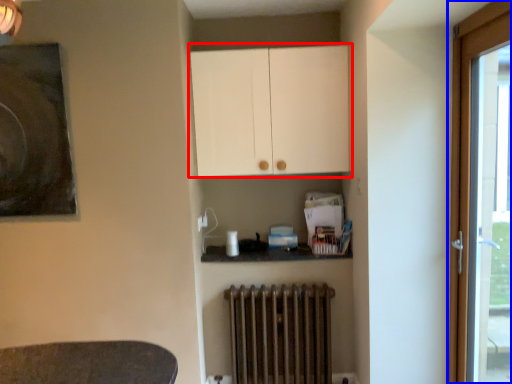
Question: Among these objects, which one is nearest to the camera, cabinetry (highlighted by a red box) or door (highlighted by a blue box)?

Choices:
 (A) cabinetry
 (B) door

Answer: (B)